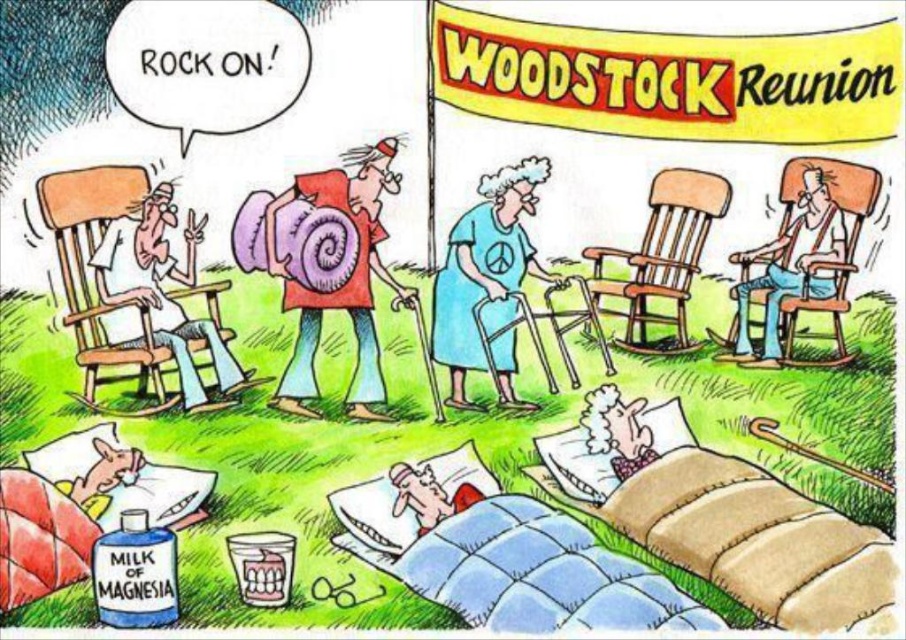
Question: Among these points, which one is nearest to the camera?

Choices:
 (A) (138, 248)
 (B) (834, 273)
 (C) (307, 372)

Answer: (A)

Question: Which of the following is the closest to the observer?

Choices:
 (A) pink fabric pillow at lower center
 (B) blue fabric walker at center
 (C) smooth brown chair at right

Answer: (A)

Question: Does blue fabric walker at center have a smaller size compared to matte red shirt at center?

Choices:
 (A) no
 (B) yes

Answer: (B)

Question: Does white fabric shirt at left have a greater width compared to pink fabric pillow at lower center?

Choices:
 (A) no
 (B) yes

Answer: (B)

Question: Considering the relative positions of matte red shirt at center and pink fabric pillow at lower center in the image provided, where is matte red shirt at center located with respect to pink fabric pillow at lower center?

Choices:
 (A) left
 (B) right

Answer: (A)

Question: Considering the real-world distances, which object is closest to the smooth brown chair at right?

Choices:
 (A) pink fabric pillow at lower center
 (B) white fabric shirt at left

Answer: (A)